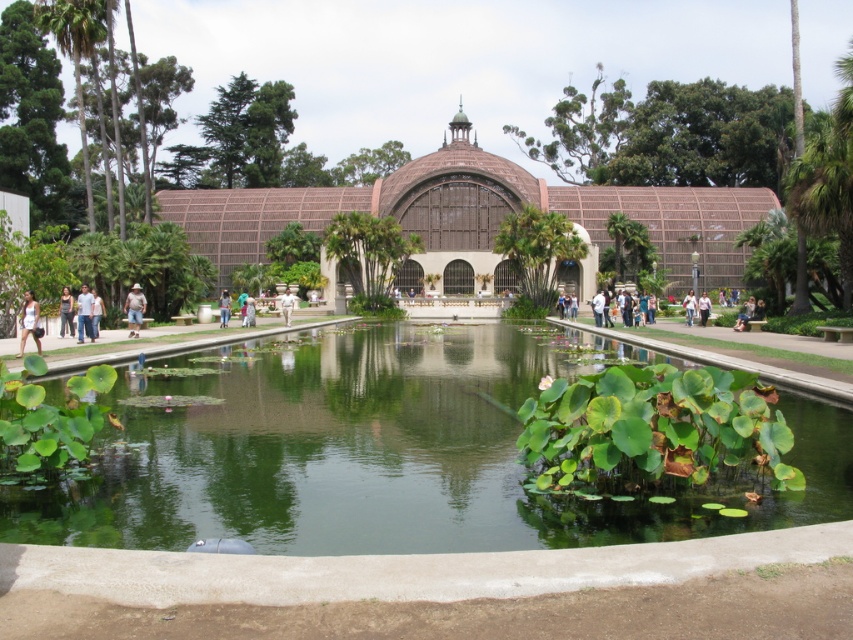
You are standing in the botanical garden and want to know how far the point at coordinates (67, 312) is from your current position. Can you determine the distance?

The point at coordinates (67, 312) is 38.66 meters away from your current position.